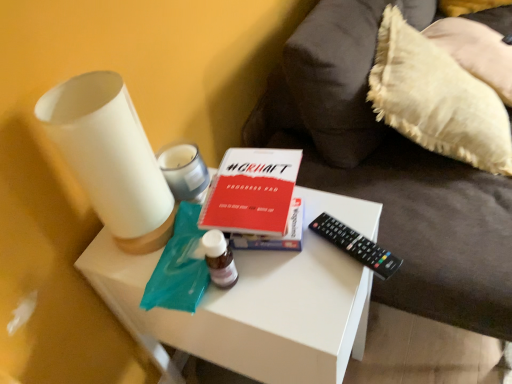
Where is `unoccupied area in front of white glossy candle at upper center, marked as the first candle holder in a back-to-front arrangement`? This screenshot has width=512, height=384. unoccupied area in front of white glossy candle at upper center, marked as the first candle holder in a back-to-front arrangement is located at coordinates (176, 248).